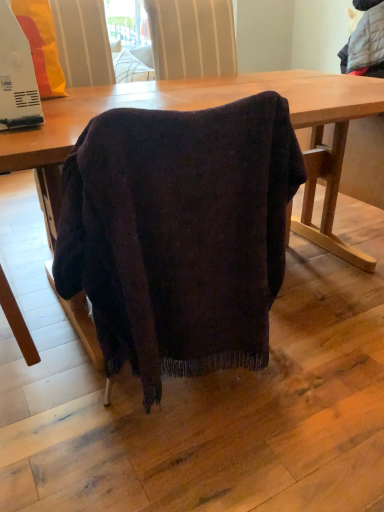
Describe the element at coordinates (196, 109) in the screenshot. I see `dark wood table at center` at that location.

This screenshot has width=384, height=512. What are the coordinates of `dark wood table at center` in the screenshot? It's located at (196, 109).

The image size is (384, 512). In order to click on white plastic microwave at upper left in this screenshot , I will do click(x=16, y=76).

What do you see at coordinates (16, 76) in the screenshot? This screenshot has width=384, height=512. I see `white plastic microwave at upper left` at bounding box center [16, 76].

This screenshot has width=384, height=512. I want to click on dark wood table at center, so click(x=196, y=109).

Considering the positions of objects white plastic microwave at upper left and dark wood table at center in the image provided, who is more to the right, white plastic microwave at upper left or dark wood table at center?

Positioned to the right is dark wood table at center.

Does white plastic microwave at upper left come behind dark wood table at center?

That is True.

Does point (2, 23) appear closer or farther from the camera than point (298, 82)?

Point (2, 23) is closer to the camera than point (298, 82).

From the image's perspective, is white plastic microwave at upper left below dark wood table at center?

Actually, white plastic microwave at upper left appears above dark wood table at center in the image.

From a real-world perspective, does white plastic microwave at upper left sit lower than dark wood table at center?

No, from a real-world perspective, white plastic microwave at upper left is not under dark wood table at center.

Is white plastic microwave at upper left thinner than dark wood table at center?

Indeed, white plastic microwave at upper left has a lesser width compared to dark wood table at center.

Based on the photo, is white plastic microwave at upper left shorter than dark wood table at center?

Correct, white plastic microwave at upper left is not as tall as dark wood table at center.

From the picture: Considering the relative sizes of white plastic microwave at upper left and dark wood table at center in the image provided, is white plastic microwave at upper left bigger than dark wood table at center?

Actually, white plastic microwave at upper left might be smaller than dark wood table at center.

Is white plastic microwave at upper left outside of dark wood table at center?

That's correct, white plastic microwave at upper left is outside of dark wood table at center.

Is white plastic microwave at upper left positioned far away from dark wood table at center?

No, white plastic microwave at upper left is in close proximity to dark wood table at center.

Is white plastic microwave at upper left oriented towards dark wood table at center?

No, white plastic microwave at upper left is not facing towards dark wood table at center.

How many degrees apart are the facing directions of white plastic microwave at upper left and dark wood table at center?

The facing directions of white plastic microwave at upper left and dark wood table at center are 85.4 degrees apart.

Where is `appliance above the dark wood table at center (from the image's perspective)`? appliance above the dark wood table at center (from the image's perspective) is located at coordinates (16, 76).

Which object is positioned more to the right, dark wood table at center or white plastic microwave at upper left?

dark wood table at center is more to the right.

Is dark wood table at center positioned in front of white plastic microwave at upper left?

That is True.

Does point (212, 89) come closer to viewer compared to point (14, 38)?

No.

From the image's perspective, is dark wood table at center beneath white plastic microwave at upper left?

Yes.

In the scene shown: From a real-world perspective, is dark wood table at center located beneath white plastic microwave at upper left?

Correct, in the physical world, dark wood table at center is lower than white plastic microwave at upper left.

Can you confirm if dark wood table at center is thinner than white plastic microwave at upper left?

In fact, dark wood table at center might be wider than white plastic microwave at upper left.

Is dark wood table at center taller than white plastic microwave at upper left?

Yes.

Can you confirm if dark wood table at center is bigger than white plastic microwave at upper left?

Yes.

Is dark wood table at center located outside white plastic microwave at upper left?

dark wood table at center lies outside white plastic microwave at upper left's area.

Is dark wood table at center touching white plastic microwave at upper left?

No, dark wood table at center is not touching white plastic microwave at upper left.

Is dark wood table at center oriented towards white plastic microwave at upper left?

No, dark wood table at center is not turned towards white plastic microwave at upper left.

The height and width of the screenshot is (512, 384). In order to click on table below the white plastic microwave at upper left (from a real-world perspective) in this screenshot , I will do coord(196,109).

The image size is (384, 512). In order to click on appliance above the dark wood table at center (from a real-world perspective) in this screenshot , I will do `click(16, 76)`.

You are a GUI agent. You are given a task and a screenshot of the screen. Output one action in this format:
    pyautogui.click(x=<x>, y=<y>)
    Task: Click on the table below the white plastic microwave at upper left (from a real-world perspective)
    Image resolution: width=384 pixels, height=512 pixels.
    Given the screenshot: What is the action you would take?
    pyautogui.click(x=196, y=109)